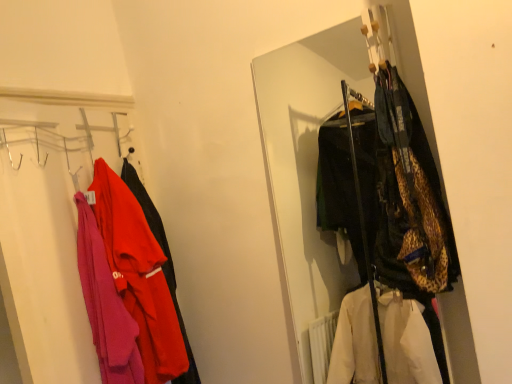
Question: Can leopard print jacket at center, which ranks as the first closet in right-to-left order, be found inside matte pink sweater at left, marked as the 1th closet in a left-to-right arrangement?

Choices:
 (A) yes
 (B) no

Answer: (B)

Question: Is matte pink sweater at left, marked as the 1th closet in a left-to-right arrangement, oriented away from leopard print jacket at center, which ranks as the first closet in right-to-left order?

Choices:
 (A) yes
 (B) no

Answer: (B)

Question: From the image's perspective, would you say matte pink sweater at left, which is the second closet in right-to-left order, is shown under leopard print jacket at center, arranged as the 2th closet when viewed from the left?

Choices:
 (A) yes
 (B) no

Answer: (A)

Question: Can you confirm if matte pink sweater at left, which is the second closet in right-to-left order, is positioned to the left of leopard print jacket at center, which ranks as the first closet in right-to-left order?

Choices:
 (A) no
 (B) yes

Answer: (B)

Question: Is matte pink sweater at left, which is the second closet in right-to-left order, far away from leopard print jacket at center, arranged as the 2th closet when viewed from the left?

Choices:
 (A) yes
 (B) no

Answer: (A)

Question: Choose the correct answer: Is matte pink sweater at left, which is the second closet in right-to-left order, inside leopard print jacket at center, which ranks as the first closet in right-to-left order, or outside it?

Choices:
 (A) inside
 (B) outside

Answer: (B)

Question: In the image, is matte pink sweater at left, which is the second closet in right-to-left order, positioned in front of or behind leopard print jacket at center, which ranks as the first closet in right-to-left order?

Choices:
 (A) behind
 (B) front

Answer: (A)

Question: Considering the positions of point 126,299 and point 308,94, is point 126,299 closer or farther from the camera than point 308,94?

Choices:
 (A) farther
 (B) closer

Answer: (B)

Question: Considering the positions of matte pink sweater at left, which is the second closet in right-to-left order, and leopard print jacket at center, which ranks as the first closet in right-to-left order, in the image, is matte pink sweater at left, which is the second closet in right-to-left order, wider or thinner than leopard print jacket at center, which ranks as the first closet in right-to-left order,?

Choices:
 (A) wide
 (B) thin

Answer: (B)

Question: Is matte pink sweater at left, marked as the 1th closet in a left-to-right arrangement, to the left or to the right of matte red jacket at left in the image?

Choices:
 (A) right
 (B) left

Answer: (B)

Question: From a real-world perspective, is matte pink sweater at left, which is the second closet in right-to-left order, physically located above or below matte red jacket at left?

Choices:
 (A) below
 (B) above

Answer: (B)

Question: From the image's perspective, is matte pink sweater at left, which is the second closet in right-to-left order, positioned above or below matte red jacket at left?

Choices:
 (A) below
 (B) above

Answer: (A)

Question: Looking at their shapes, would you say matte pink sweater at left, marked as the 1th closet in a left-to-right arrangement, is wider or thinner than matte red jacket at left?

Choices:
 (A) wide
 (B) thin

Answer: (B)

Question: Visually, is leopard print jacket at center, arranged as the 2th closet when viewed from the left, positioned to the left or to the right of matte red jacket at left?

Choices:
 (A) right
 (B) left

Answer: (A)

Question: Which is correct: leopard print jacket at center, arranged as the 2th closet when viewed from the left, is inside matte red jacket at left, or outside of it?

Choices:
 (A) inside
 (B) outside

Answer: (B)